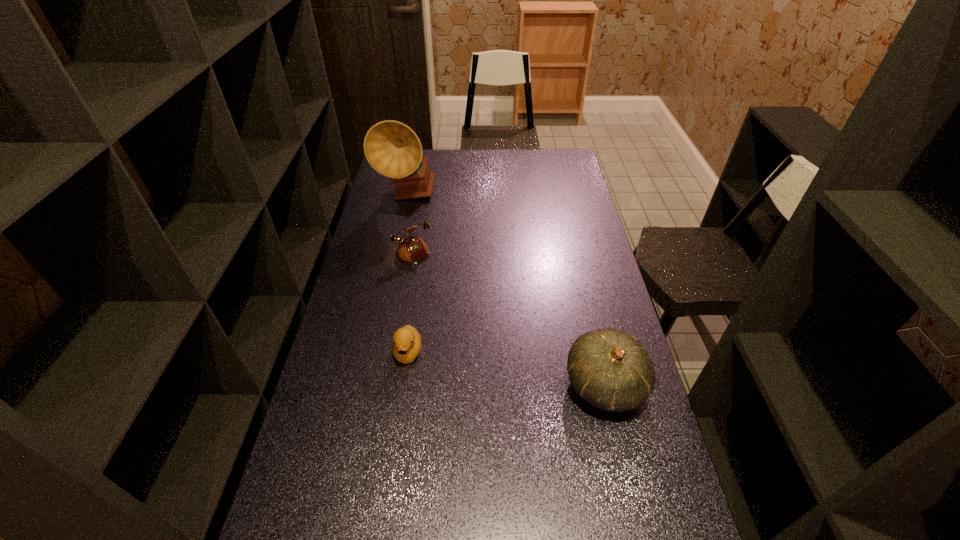
This screenshot has height=540, width=960. I want to click on vacant region between the telephone and the rightmost object, so click(501, 325).

Image resolution: width=960 pixels, height=540 pixels. I want to click on free space between the tallest object and the duckling, so click(407, 273).

Choose which object is the second nearest neighbor to the telephone. Please provide its 2D coordinates. Your answer should be formatted as a tuple, i.e. [(x, y)], where the tuple contains the x and y coordinates of a point satisfying the conditions above.

[(406, 346)]

Identify which object is located as the third nearest to the phonograph record. Please provide its 2D coordinates. Your answer should be formatted as a tuple, i.e. [(x, y)], where the tuple contains the x and y coordinates of a point satisfying the conditions above.

[(611, 370)]

Locate an element on the screen. The width and height of the screenshot is (960, 540). free location that satisfies the following two spatial constraints: 1. on the face of the duckling; 2. on the left side of the second tallest object is located at coordinates (403, 385).

In order to click on vacant area that satisfies the following two spatial constraints: 1. on the face of the rightmost object; 2. on the left side of the duckling in this screenshot , I will do `click(403, 385)`.